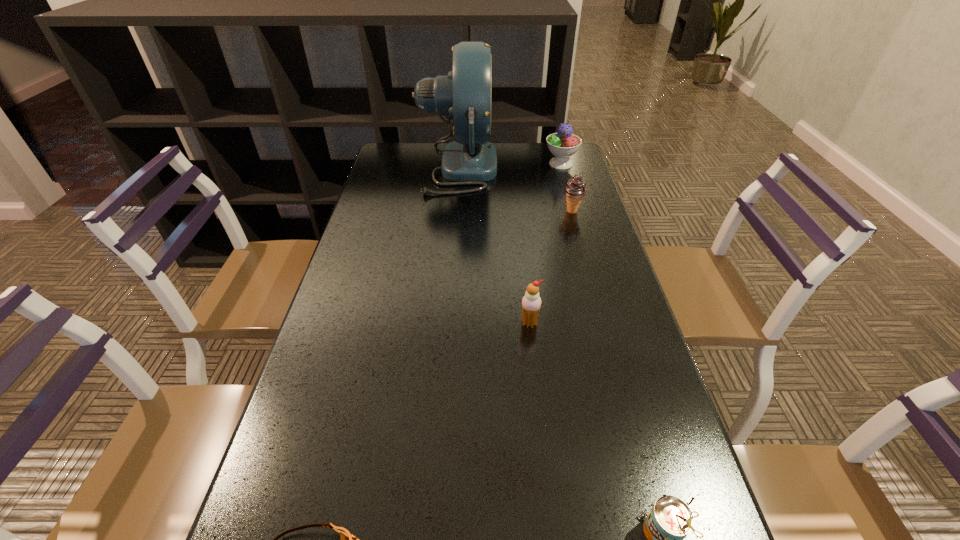
The image size is (960, 540). I want to click on icecream that is positioned at the far edge, so click(x=563, y=144).

At what (x,y) coordinates should I click in order to perform the action: click on object that is at the left edge. Please return your answer as a coordinate pair (x, y). The width and height of the screenshot is (960, 540). Looking at the image, I should click on (465, 95).

The width and height of the screenshot is (960, 540). Find the location of `object situated at the far left corner`. object situated at the far left corner is located at coordinates (465, 95).

What are the coordinates of `object positioned at the far right corner` in the screenshot? It's located at (563, 144).

The width and height of the screenshot is (960, 540). What are the coordinates of `vacant space at the left edge of the desktop` in the screenshot? It's located at (380, 253).

Locate an element on the screen. This screenshot has height=540, width=960. free space at the right edge of the desktop is located at coordinates (636, 525).

At what (x,y) coordinates should I click in order to perform the action: click on vacant area at the far left corner of the desktop. Please return your answer as a coordinate pair (x, y). Looking at the image, I should click on (405, 152).

You are a GUI agent. You are given a task and a screenshot of the screen. Output one action in this format:
    pyautogui.click(x=<x>, y=<y>)
    Task: Click on the free space between the tallest object and the farthest icecream
    
    Given the screenshot: What is the action you would take?
    pyautogui.click(x=510, y=166)

Image resolution: width=960 pixels, height=540 pixels. What are the coordinates of `vacant space in between the leftmost icecream and the tallest object` in the screenshot? It's located at (493, 246).

Image resolution: width=960 pixels, height=540 pixels. Identify the location of blank region between the tallest object and the fourth nearest object. (516, 190).